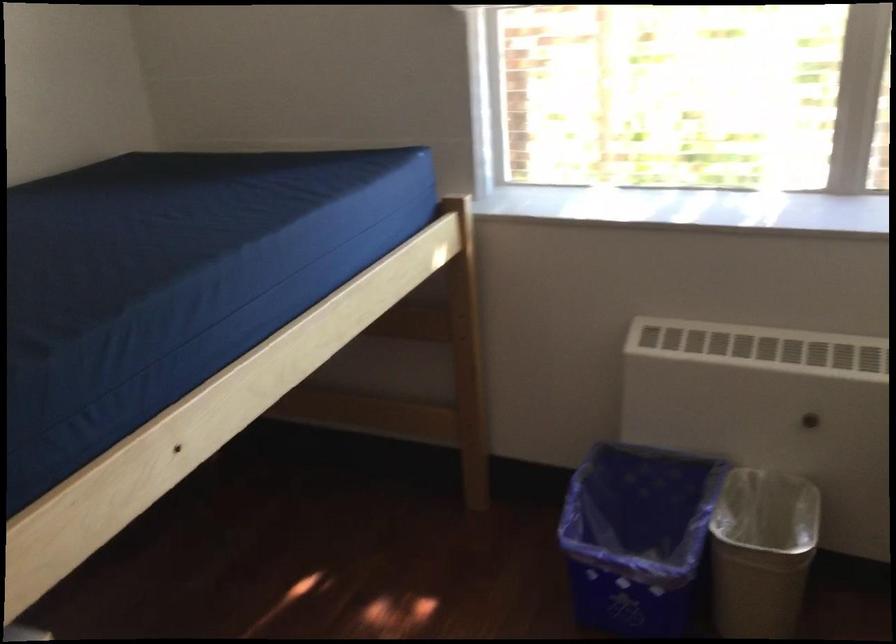
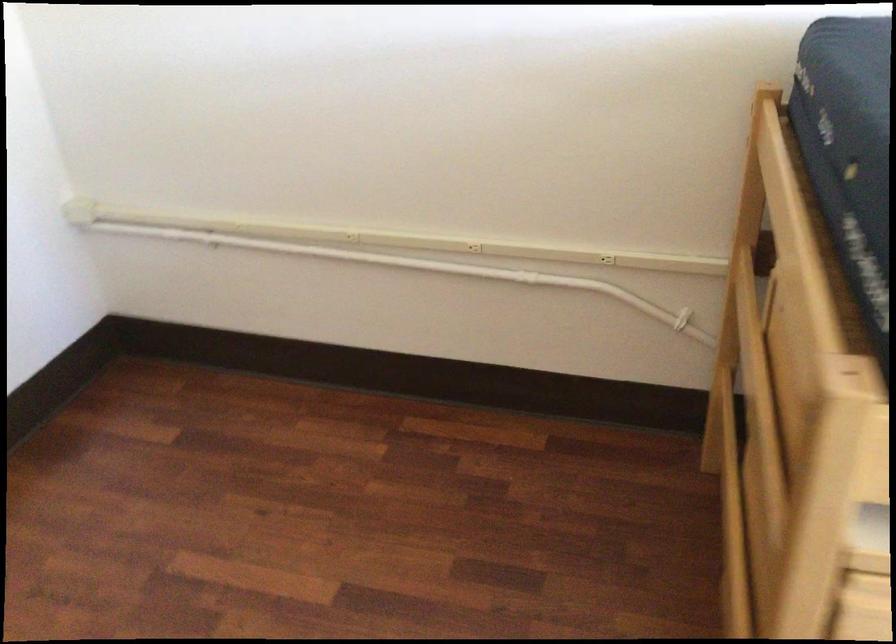
First-person continuous shooting, in which direction is the camera rotating?

The rotation direction of the camera is left-down.